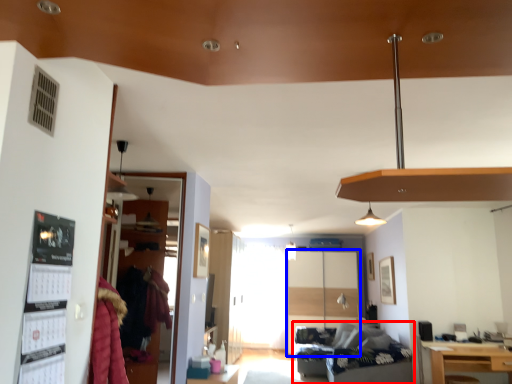
Question: Which object is further to the camera taking this photo, studio couch (highlighted by a red box) or glass door (highlighted by a blue box)?

Choices:
 (A) studio couch
 (B) glass door

Answer: (B)